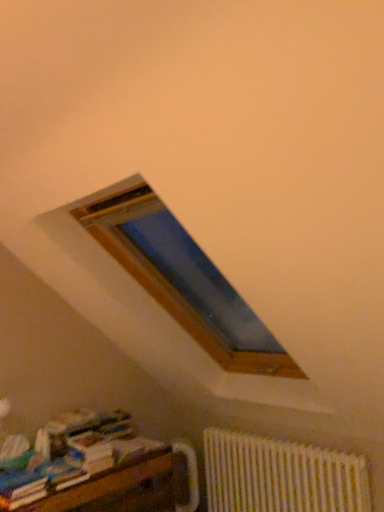
This screenshot has height=512, width=384. What do you see at coordinates (93, 469) in the screenshot?
I see `wooden bookshelf at lower left` at bounding box center [93, 469].

At what (x,y) coordinates should I click in order to perform the action: click on white textured radiator at lower right. Please return your answer as a coordinate pair (x, y). Looking at the image, I should click on (281, 476).

The image size is (384, 512). Identify the location of multicolored paper at lower left. (21, 489).

Where is `wooden bookshelf at lower left`? The image size is (384, 512). wooden bookshelf at lower left is located at coordinates (93, 469).

Does wooden bookshelf at lower left have a greater height compared to multicolored paper at lower left?

Yes.

Considering the relative sizes of wooden bookshelf at lower left and multicolored paper at lower left in the image provided, is wooden bookshelf at lower left thinner than multicolored paper at lower left?

Incorrect, the width of wooden bookshelf at lower left is not less than that of multicolored paper at lower left.

Are wooden bookshelf at lower left and multicolored paper at lower left far apart?

No.

Looking at this image, is wooden bookshelf at lower left facing away from multicolored paper at lower left?

wooden bookshelf at lower left does not have its back to multicolored paper at lower left.

Based on the photo, could you tell me if white textured radiator at lower right is turned towards wooden bookshelf at lower left?

Yes.

Based on the photo, is wooden bookshelf at lower left a part of white textured radiator at lower right?

No, wooden bookshelf at lower left is located outside of white textured radiator at lower right.

Are white textured radiator at lower right and wooden bookshelf at lower left beside each other?

No, white textured radiator at lower right is not in contact with wooden bookshelf at lower left.

Considering the relative positions of white textured radiator at lower right and wooden bookshelf at lower left in the image provided, is white textured radiator at lower right behind wooden bookshelf at lower left?

Yes, the depth of white textured radiator at lower right is greater than that of wooden bookshelf at lower left.

From the image's perspective, which object appears higher, wooden bookshelf at lower left or white textured radiator at lower right?

wooden bookshelf at lower left appears higher in the image.

This screenshot has height=512, width=384. In the image, there is a wooden bookshelf at lower left. In order to click on radiator below it (from a real-world perspective) in this screenshot , I will do `click(281, 476)`.

Choose the correct answer: Is wooden bookshelf at lower left inside white textured radiator at lower right or outside it?

wooden bookshelf at lower left lies outside white textured radiator at lower right.

From a real-world perspective, is white textured radiator at lower right above or below multicolored paper at lower left?

white textured radiator at lower right is situated lower than multicolored paper at lower left in the real world.

Find the location of a particular element. This screenshot has height=512, width=384. radiator behind the multicolored paper at lower left is located at coordinates (281, 476).

Is white textured radiator at lower right located outside multicolored paper at lower left?

white textured radiator at lower right lies outside multicolored paper at lower left's area.

Is the surface of white textured radiator at lower right in direct contact with multicolored paper at lower left?

No.

Is multicolored paper at lower left looking in the opposite direction of wooden bookshelf at lower left?

No, multicolored paper at lower left is not facing the opposite direction of wooden bookshelf at lower left.

Is point (28, 499) positioned before point (122, 435)?

Yes, it is in front of point (122, 435).

Does multicolored paper at lower left appear on the right side of wooden bookshelf at lower left?

No.

From a real-world perspective, is multicolored paper at lower left above or below white textured radiator at lower right?

From a real-world perspective, multicolored paper at lower left is physically above white textured radiator at lower right.

Does multicolored paper at lower left turn towards white textured radiator at lower right?

No, multicolored paper at lower left does not turn towards white textured radiator at lower right.

Find the location of `paperback book located above the white textured radiator at lower right (from the image's perspective)`. paperback book located above the white textured radiator at lower right (from the image's perspective) is located at coordinates (21, 489).

The image size is (384, 512). Identify the location of paperback book behind the wooden bookshelf at lower left. click(21, 489).

Locate an element on the screen. The width and height of the screenshot is (384, 512). radiator that is on the right side of wooden bookshelf at lower left is located at coordinates (281, 476).

Considering their positions, is white textured radiator at lower right positioned closer to wooden bookshelf at lower left than multicolored paper at lower left?

multicolored paper at lower left lies closer to wooden bookshelf at lower left than the other object.

When comparing their distances from white textured radiator at lower right, does multicolored paper at lower left or wooden bookshelf at lower left seem further?

Among the two, multicolored paper at lower left is located further to white textured radiator at lower right.

From the image, which object appears to be farther from multicolored paper at lower left, white textured radiator at lower right or wooden bookshelf at lower left?

→ white textured radiator at lower right.

In the scene shown: Which object lies nearer to the anchor point multicolored paper at lower left, wooden bookshelf at lower left or white textured radiator at lower right?

wooden bookshelf at lower left is positioned closer to the anchor multicolored paper at lower left.

Which object lies further to the anchor point wooden bookshelf at lower left, multicolored paper at lower left or white textured radiator at lower right?

white textured radiator at lower right.

Looking at the image, which one is located further to white textured radiator at lower right, wooden bookshelf at lower left or multicolored paper at lower left?

multicolored paper at lower left is positioned further to the anchor white textured radiator at lower right.

Locate an element on the screen. This screenshot has width=384, height=512. furniture located between multicolored paper at lower left and white textured radiator at lower right in the left-right direction is located at coordinates (93, 469).